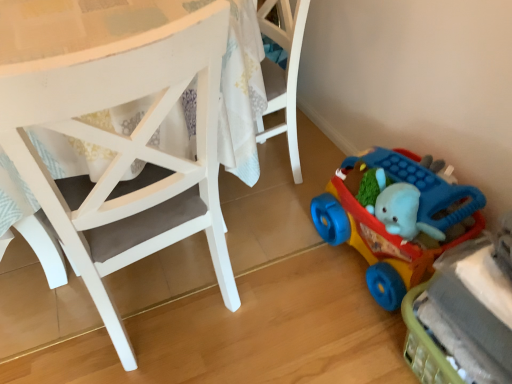
Question: In terms of width, does rubberized plastic toy car at lower right, the 1th toy from the top, look wider or thinner when compared to rubberized plastic toy car at lower right, the first toy from the bottom?

Choices:
 (A) wide
 (B) thin

Answer: (A)

Question: Which is correct: rubberized plastic toy car at lower right, the 1th toy from the top, is inside rubberized plastic toy car at lower right, the first toy from the bottom, or outside of it?

Choices:
 (A) inside
 (B) outside

Answer: (B)

Question: Estimate the real-world distances between objects in this image. Which object is closer to the rubberized plastic toy car at lower right, the 1th toy from the top?

Choices:
 (A) rubberized plastic toy car at lower right, the first toy from the bottom
 (B) white matte chair at center

Answer: (A)

Question: Estimate the real-world distances between objects in this image. Which object is closer to the rubberized plastic toy car at lower right, the first toy from the bottom?

Choices:
 (A) white matte chair at center
 (B) rubberized plastic toy car at lower right, acting as the 2th toy starting from the bottom

Answer: (B)